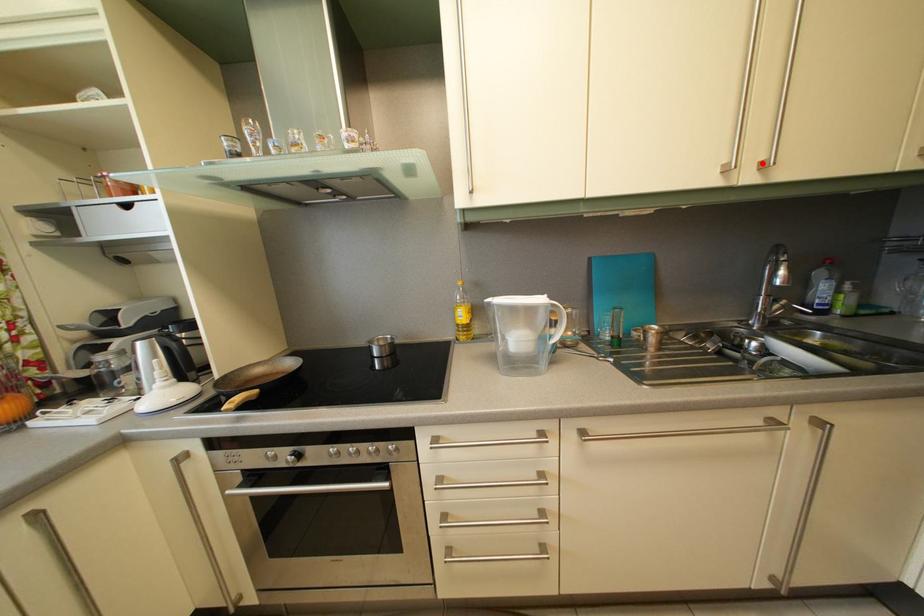
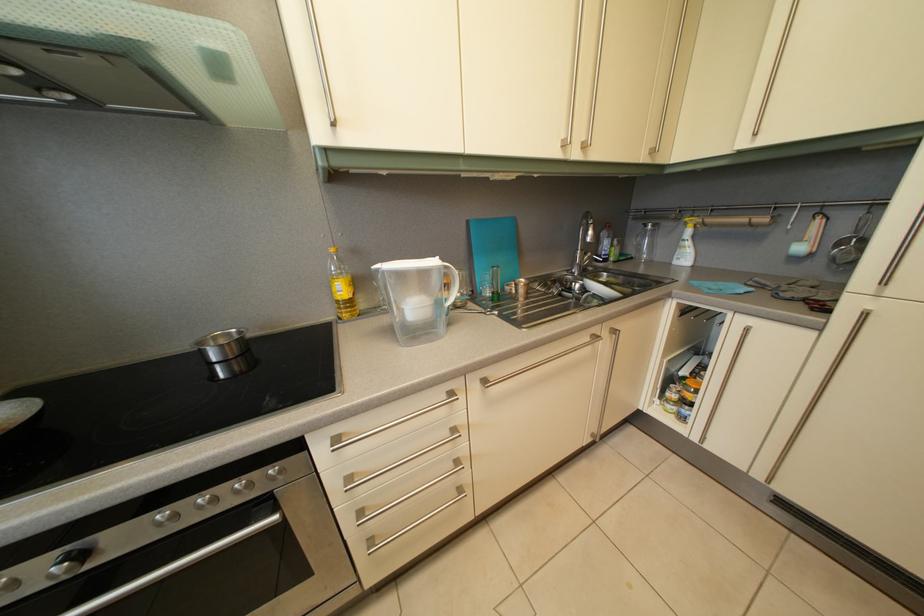
In the second image, find the point that corresponds to the highlighted location in the first image.

(588, 143)